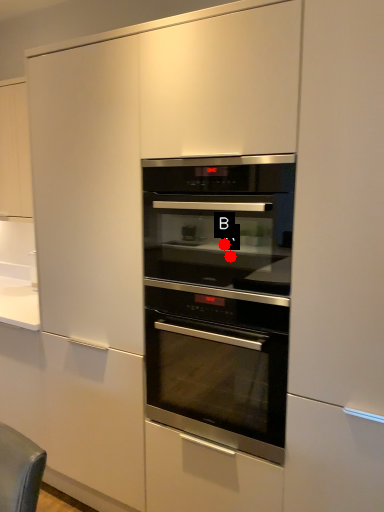
Question: Two points are circled on the image, labeled by A and B beside each circle. Which point is farther to the camera?

Choices:
 (A) A is further
 (B) B is further

Answer: (B)